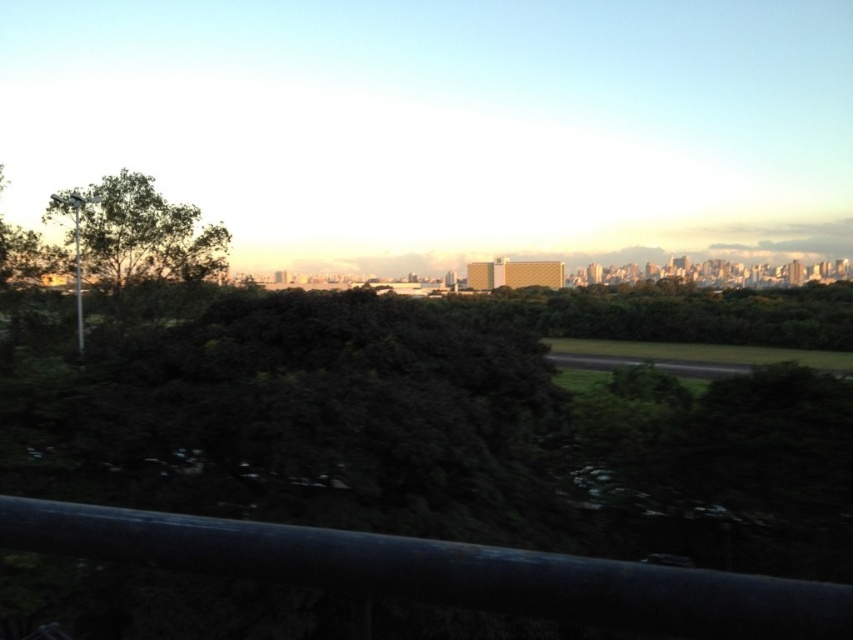
Question: Among these objects, which one is farthest from the camera?

Choices:
 (A) green leafy tree at left
 (B) black metal rail at lower center

Answer: (A)

Question: Which point is closer to the camera?

Choices:
 (A) green leafy tree at left
 (B) black metal rail at lower center

Answer: (B)

Question: Is black metal rail at lower center wider than green leafy tree at left?

Choices:
 (A) yes
 (B) no

Answer: (B)

Question: Does black metal rail at lower center have a greater width compared to green leafy tree at left?

Choices:
 (A) no
 (B) yes

Answer: (A)

Question: Which point is closer to the camera?

Choices:
 (A) (194, 262)
 (B) (825, 582)

Answer: (B)

Question: Observing the image, what is the correct spatial positioning of black metal rail at lower center in reference to green leafy tree at left?

Choices:
 (A) right
 (B) left

Answer: (A)